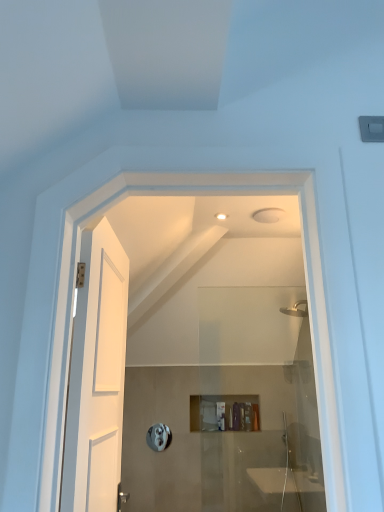
Question: Is white wooden door at left positioned before matte plastic toiletry at center, the first toiletry positioned from the right?

Choices:
 (A) yes
 (B) no

Answer: (A)

Question: From a real-world perspective, is white wooden door at left located higher than matte plastic toiletry at center, which is counted as the 2th toiletry, starting from the left?

Choices:
 (A) yes
 (B) no

Answer: (A)

Question: From the image's perspective, would you say white wooden door at left is shown under matte plastic toiletry at center, which is counted as the 2th toiletry, starting from the left?

Choices:
 (A) yes
 (B) no

Answer: (B)

Question: Is the depth of white wooden door at left greater than that of matte plastic toiletry at center, which is counted as the 2th toiletry, starting from the left?

Choices:
 (A) yes
 (B) no

Answer: (B)

Question: Could you tell me if white wooden door at left is turned towards matte plastic toiletry at center, the first toiletry positioned from the right?

Choices:
 (A) yes
 (B) no

Answer: (B)

Question: Considering the positions of point (258, 417) and point (157, 430), is point (258, 417) closer or farther from the camera than point (157, 430)?

Choices:
 (A) closer
 (B) farther

Answer: (B)

Question: Is matte plastic toiletry at center, which is counted as the 2th toiletry, starting from the left, to the left or to the right of silver metallic towel bar at center in the image?

Choices:
 (A) right
 (B) left

Answer: (A)

Question: Which is correct: matte plastic toiletry at center, which is counted as the 2th toiletry, starting from the left, is inside silver metallic towel bar at center, or outside of it?

Choices:
 (A) inside
 (B) outside

Answer: (B)

Question: From their relative heights in the image, would you say matte plastic toiletry at center, which is counted as the 2th toiletry, starting from the left, is taller or shorter than silver metallic towel bar at center?

Choices:
 (A) short
 (B) tall

Answer: (A)

Question: Visually, is translucent plastic container at center, the 2th toiletry viewed from the right, positioned to the left or to the right of matte plastic toiletry at center, the first toiletry positioned from the right?

Choices:
 (A) left
 (B) right

Answer: (A)

Question: Do you think translucent plastic container at center, the 2th toiletry viewed from the right, is within matte plastic toiletry at center, which is counted as the 2th toiletry, starting from the left, or outside of it?

Choices:
 (A) outside
 (B) inside

Answer: (A)

Question: Relative to matte plastic toiletry at center, which is counted as the 2th toiletry, starting from the left, is translucent plastic container at center, the 2th toiletry viewed from the right, in front or behind?

Choices:
 (A) behind
 (B) front

Answer: (B)

Question: Considering the positions of translucent plastic container at center, which is counted as the first toiletry, starting from the left, and matte plastic toiletry at center, the first toiletry positioned from the right, in the image, is translucent plastic container at center, which is counted as the first toiletry, starting from the left, taller or shorter than matte plastic toiletry at center, the first toiletry positioned from the right,?

Choices:
 (A) short
 (B) tall

Answer: (B)

Question: In terms of height, does silver metallic towel bar at center look taller or shorter compared to matte plastic toiletry at center, the first toiletry positioned from the right?

Choices:
 (A) tall
 (B) short

Answer: (A)

Question: From the image's perspective, is silver metallic towel bar at center above or below matte plastic toiletry at center, which is counted as the 2th toiletry, starting from the left?

Choices:
 (A) below
 (B) above

Answer: (A)